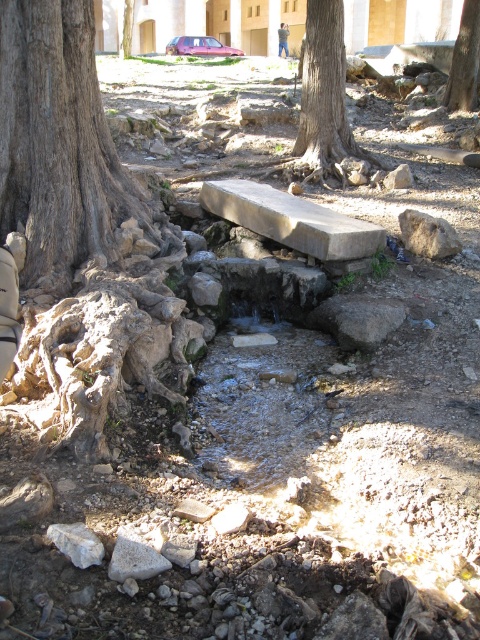
You are standing at the origin point of the image coordinate system where the bottom left corner is considered as the origin. You want to walk towards the brown rough tree at upper center. In which direction should you move?

Since the brown rough tree at upper center is located at point (465,60) in the image coordinate system, you should move towards the upper left direction from your current position at the origin.

You are a hiker who wants to take a break on the bench near the water feature. You notice a brown rough tree at center and a brown leather jacket at upper center. Which object is shorter in height?

The brown rough tree at center has a lesser height compared to the brown leather jacket at upper center, so the brown rough tree at center is shorter.

You are standing at the point marked as point (465, 60) in the image. Looking around, you see a brown rough tree at upper center. What is the nearest object to you in this scene?

The nearest object to you is the brown rough tree at upper center because the point (465, 60) corresponds to it.